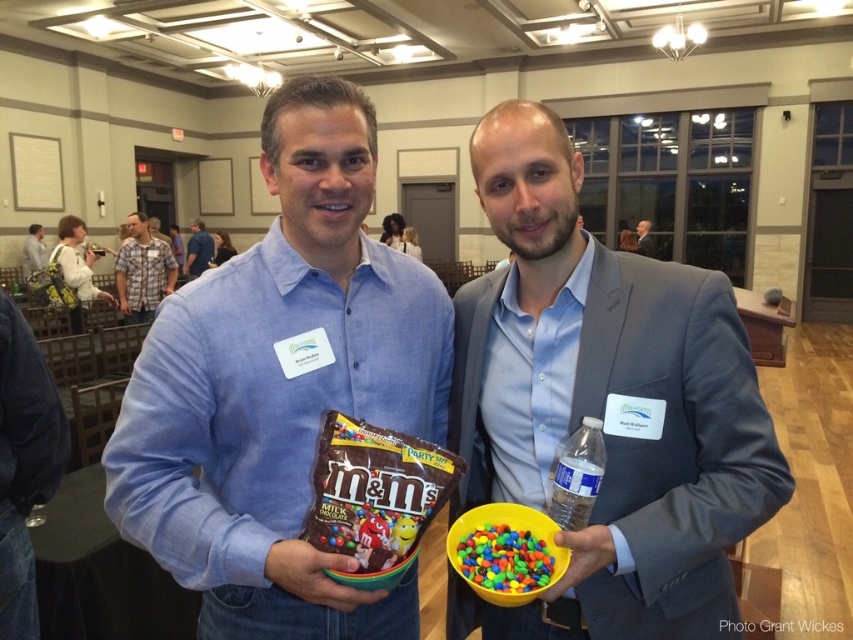
Question: Among these objects, which one is nearest to the camera?

Choices:
 (A) light brown leather jacket at upper left
 (B) matte blue shirt at center
 (C) matte brown bag of m&m's at center

Answer: (B)

Question: Which object appears farthest from the camera in this image?

Choices:
 (A) clear plastic bottle at center
 (B) matte gray suit at center
 (C) dark gray suit at upper right

Answer: (C)

Question: Estimate the real-world distances between objects in this image. Which object is farther from the clear plastic bottle at center?

Choices:
 (A) light brown leather jacket at upper left
 (B) matte gray suit at center

Answer: (A)

Question: Is blue cotton shirt at center thinner than light blue shirt at center?

Choices:
 (A) yes
 (B) no

Answer: (B)

Question: Can you confirm if shiny plastic bowl of m&ms at center is thinner than light blue shirt at center?

Choices:
 (A) yes
 (B) no

Answer: (A)

Question: Is clear plastic bottle at center behind dark gray suit at upper right?

Choices:
 (A) yes
 (B) no

Answer: (B)